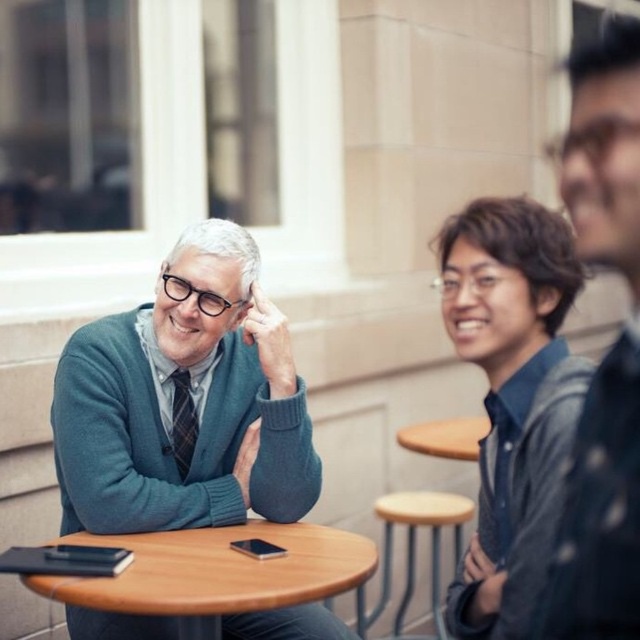
Question: Where is wooden round table at center located in relation to wooden stool at lower center in the image?

Choices:
 (A) below
 (B) above

Answer: (B)

Question: Can you confirm if matte blue shirt at center is positioned to the right of wooden stool at lower center?

Choices:
 (A) no
 (B) yes

Answer: (A)

Question: Estimate the real-world distances between objects in this image. Which object is farther from the dark blue textured shirt at right?

Choices:
 (A) wooden round table at center
 (B) matte blue shirt at center
 (C) teal sweater at center
 (D) wooden stool at lower center

Answer: (D)

Question: Which of these objects is positioned farthest from the teal sweater at center?

Choices:
 (A) wooden stool at lower center
 (B) matte blue shirt at center
 (C) dark blue textured shirt at right

Answer: (A)

Question: Does matte blue shirt at center have a greater width compared to wooden stool at lower center?

Choices:
 (A) no
 (B) yes

Answer: (A)

Question: Considering the real-world distances, which object is farthest from the wooden round table at center?

Choices:
 (A) dark blue textured shirt at right
 (B) matte blue shirt at center

Answer: (A)